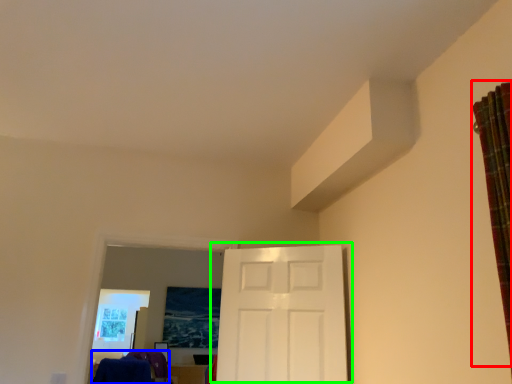
Question: Considering the real-world distances, which object is closest to curtain (highlighted by a red box)? laundry (highlighted by a blue box) or door (highlighted by a green box).

Choices:
 (A) laundry
 (B) door

Answer: (B)